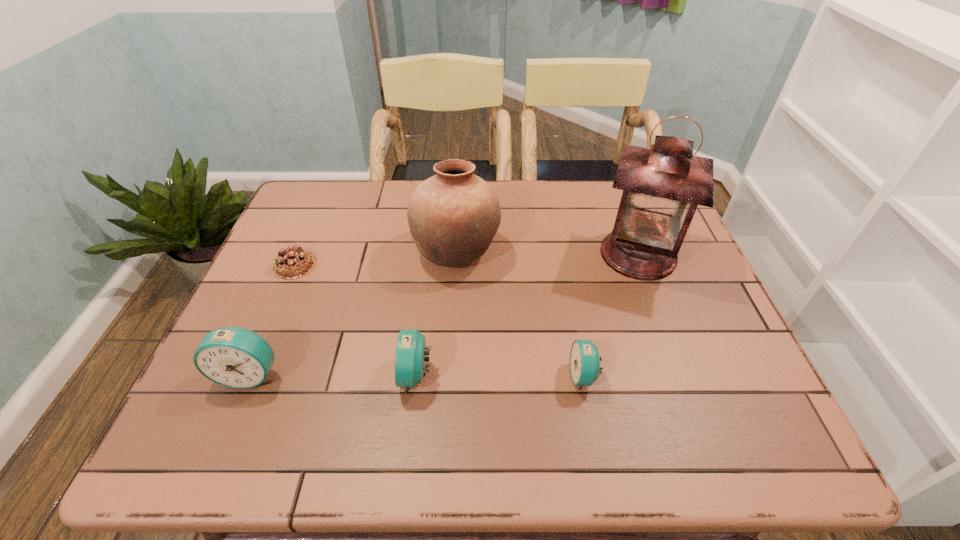
Locate an element on the screen. the leftmost alarm clock is located at coordinates (235, 357).

Locate an element on the screen. This screenshot has width=960, height=540. the third tallest object is located at coordinates (235, 357).

Locate an element on the screen. The height and width of the screenshot is (540, 960). the second shortest alarm clock is located at coordinates (410, 358).

This screenshot has height=540, width=960. Identify the location of the second alarm clock from left to right. (410, 358).

Find the location of a particular element. This screenshot has height=540, width=960. the fifth object from left to right is located at coordinates (585, 360).

This screenshot has width=960, height=540. Identify the location of the shortest alarm clock. (585, 360).

At what (x,y) coordinates should I click in order to perform the action: click on the second tallest object. Please return your answer as a coordinate pair (x, y). Looking at the image, I should click on (453, 216).

Locate an element on the screen. the shortest object is located at coordinates (291, 263).

Locate an element on the screen. the rightmost object is located at coordinates (662, 186).

The height and width of the screenshot is (540, 960). I want to click on oil lamp, so click(662, 186).